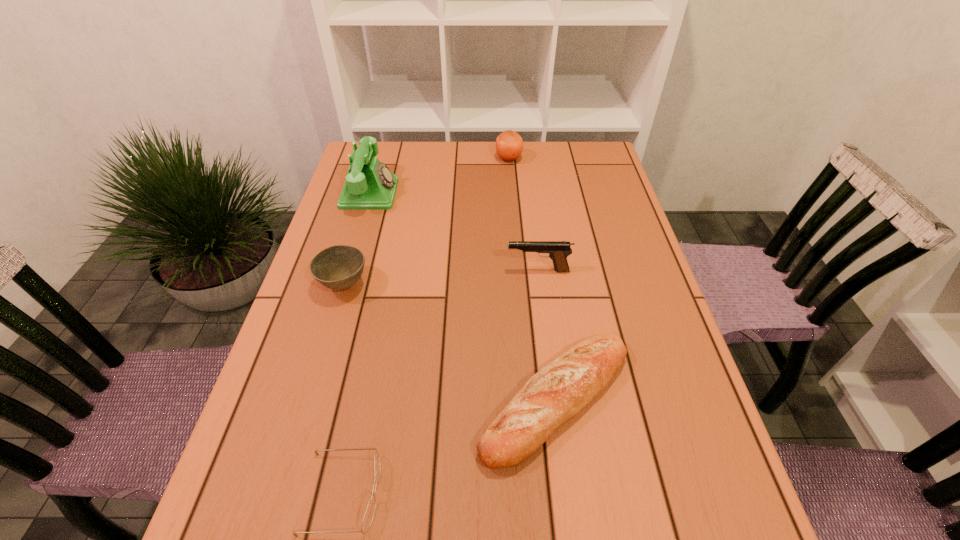
Where is `free space between the bowl and the shortest object`? The height and width of the screenshot is (540, 960). free space between the bowl and the shortest object is located at coordinates (344, 389).

Image resolution: width=960 pixels, height=540 pixels. Identify the location of vacant point located between the telephone and the baguet. (463, 296).

Locate an element on the screen. The width and height of the screenshot is (960, 540). empty location between the baguet and the bowl is located at coordinates (450, 342).

This screenshot has height=540, width=960. What are the coordinates of `empty space that is in between the shortest object and the telephone` in the screenshot? It's located at (356, 343).

The height and width of the screenshot is (540, 960). Identify the location of free space between the orange and the shortest object. (425, 326).

Image resolution: width=960 pixels, height=540 pixels. Identify the location of vacant point located between the baguet and the bowl. (450, 342).

Where is `free spot between the telephone and the shortest object`? Image resolution: width=960 pixels, height=540 pixels. free spot between the telephone and the shortest object is located at coordinates (356, 343).

Find the location of a particular element. Image resolution: width=960 pixels, height=540 pixels. free space between the spectacles and the baguet is located at coordinates (449, 447).

I want to click on object that is the fourth closest to the bowl, so click(369, 514).

Select which object appears as the fourth closest to the pistol. Please provide its 2D coordinates. Your answer should be formatted as a tuple, i.e. [(x, y)], where the tuple contains the x and y coordinates of a point satisfying the conditions above.

[(509, 145)]